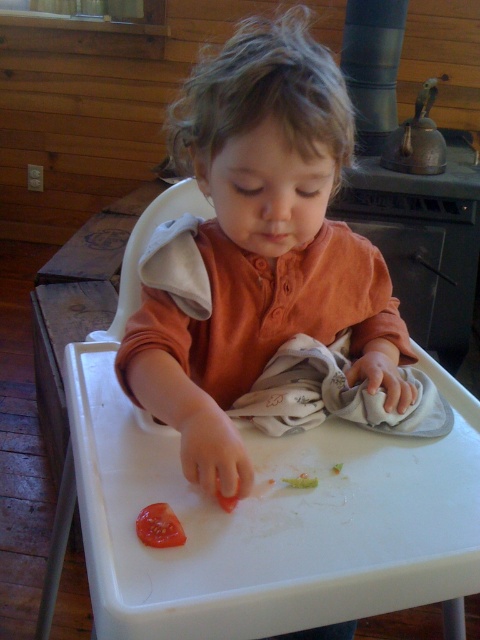
Consider the image. Does matte orange shirt at center have a lesser height compared to juicy red tomato at lower center?

Incorrect, matte orange shirt at center's height does not fall short of juicy red tomato at lower center's.

Can you confirm if matte orange shirt at center is positioned below juicy red tomato at lower center?

Actually, matte orange shirt at center is above juicy red tomato at lower center.

Who is more forward, (240, 321) or (140, 529)?

Point (140, 529) is more forward.

Locate an element on the screen. matte orange shirt at center is located at coordinates (261, 248).